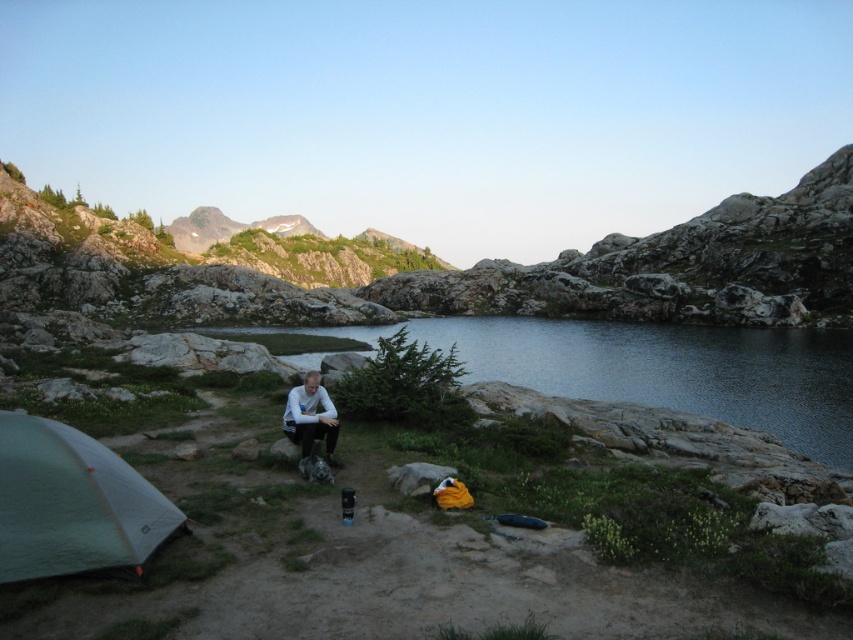
Question: Estimate the real-world distances between objects in this image. Which object is closer to the clear water at center?

Choices:
 (A) white matte shirt at center
 (B) green fabric tent at lower left

Answer: (B)

Question: Estimate the real-world distances between objects in this image. Which object is closer to the white matte shirt at center?

Choices:
 (A) green fabric tent at lower left
 (B) clear water at center

Answer: (A)

Question: Can you confirm if clear water at center is wider than white matte shirt at center?

Choices:
 (A) no
 (B) yes

Answer: (B)

Question: Where is clear water at center located in relation to green fabric tent at lower left in the image?

Choices:
 (A) below
 (B) above

Answer: (B)

Question: Based on their relative distances, which object is nearer to the green fabric tent at lower left?

Choices:
 (A) clear water at center
 (B) white matte shirt at center

Answer: (B)

Question: Does green fabric tent at lower left have a smaller size compared to white matte shirt at center?

Choices:
 (A) no
 (B) yes

Answer: (B)